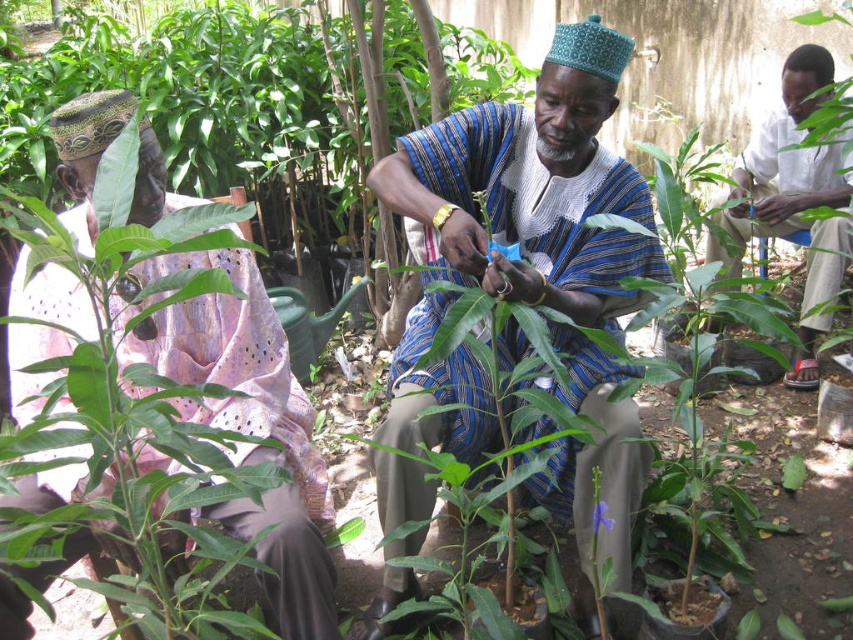
Question: Which object is farther from the camera taking this photo?

Choices:
 (A) blue striped cloth at center
 (B) matte pink fabric at left
 (C) white cotton shirt at upper right

Answer: (C)

Question: Is blue striped cloth at center behind matte pink fabric at left?

Choices:
 (A) yes
 (B) no

Answer: (A)

Question: Where is blue striped cloth at center located in relation to matte pink fabric at left in the image?

Choices:
 (A) below
 (B) above

Answer: (B)

Question: Does matte pink fabric at left appear on the left side of white cotton shirt at upper right?

Choices:
 (A) no
 (B) yes

Answer: (B)

Question: Among these points, which one is farthest from the camera?

Choices:
 (A) (537, 474)
 (B) (143, 321)

Answer: (A)

Question: Which of the following is the closest to the observer?

Choices:
 (A) blue striped cloth at center
 (B) matte pink fabric at left
 (C) white cotton shirt at upper right

Answer: (B)